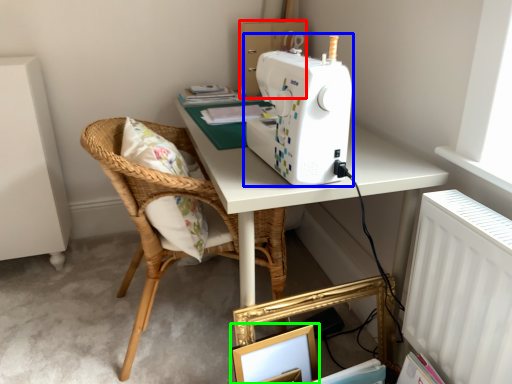
Question: Which object is positioned farthest from cardboard box (highlighted by a red box)? Select from sewing machine (highlighted by a blue box) and picture frame (highlighted by a green box).

Choices:
 (A) sewing machine
 (B) picture frame

Answer: (B)